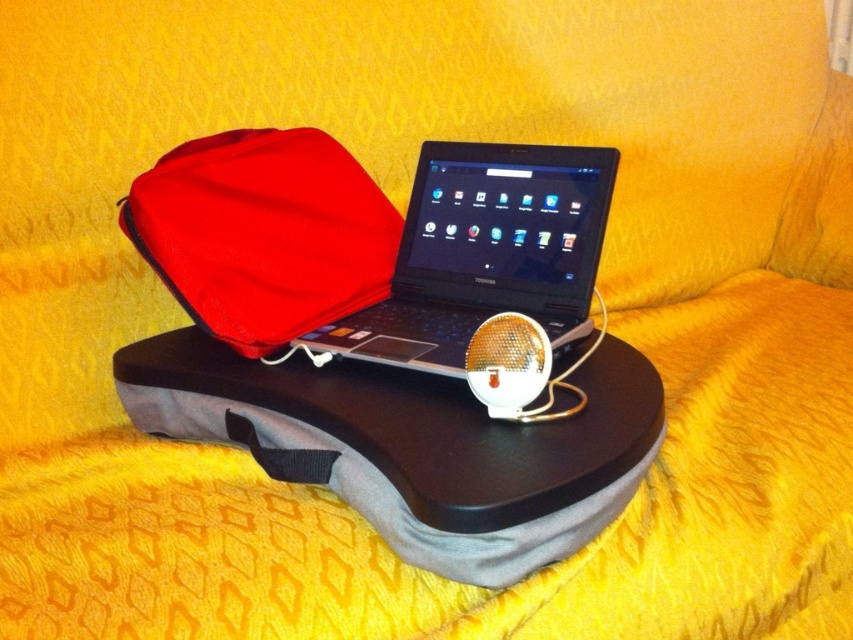
You are organizing your workspace and need to place the red fabric laptop case at center and the black plastic laptop at center into a storage compartment. The compartment can only fit items smaller than the laptop. Which item can be placed in the compartment?

The red fabric laptop case at center has a smaller size compared to the black plastic laptop at center, so it can be placed in the storage compartment since it is smaller than the laptop.

You are sitting on a chair 36 inches away from the red fabric laptop case at center. Can you reach it without moving your chair?

The red fabric laptop case at center is 34.70 inches away from the viewer. Since you are 36 inches away, you are slightly further than the distance, so you might need to move closer to reach it.

You are a photographer taking a picture of the scene. You notice two points in the image at coordinates point (367,198) and point (540,275). Which point will appear closer to the camera in the photo?

Point (367,198) is further to the camera than point (540,275), so the point (367,198) will appear closer to the camera in the photo.